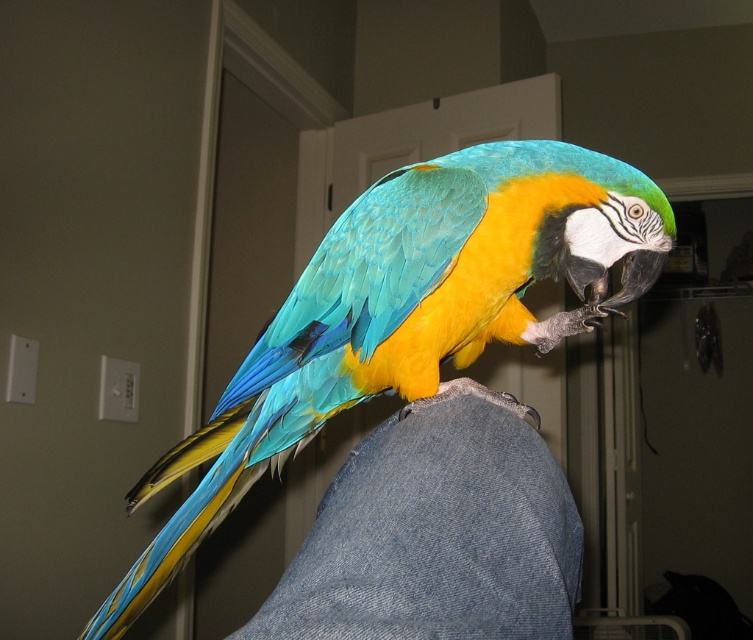
You are standing in a room where a parrot is perched on someone shoulder. You notice a point marked at coordinates (407, 316). Can you tell me what object is located at that coordinate?

The shiny blue green parrot at center is represented by point (407, 316).